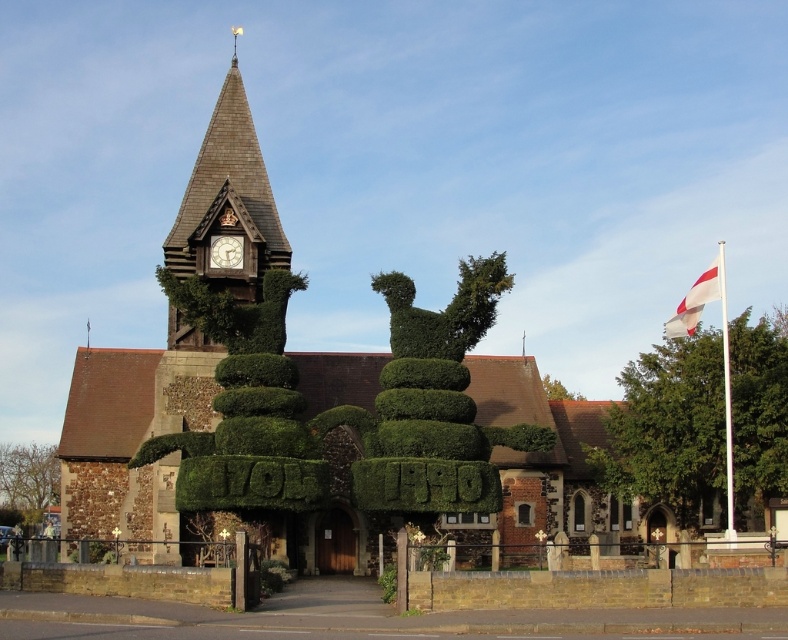
Question: Can you confirm if green leafy bush at lower left is smaller than green leafy tree at center?

Choices:
 (A) no
 (B) yes

Answer: (A)

Question: Which object is closer to the camera taking this photo?

Choices:
 (A) wooden clock at center
 (B) green leafy tree at right

Answer: (B)

Question: Which of the following is the farthest from the observer?

Choices:
 (A) (235, 262)
 (B) (9, 486)
 (C) (701, 276)

Answer: (B)

Question: Among these objects, which one is nearest to the camera?

Choices:
 (A) white fabric flag at right
 (B) wooden shingles clock tower at upper center
 (C) green leafy bush at lower left
 (D) wooden clock at center

Answer: (A)

Question: Is green leafy bush at lower left above white fabric flag at right?

Choices:
 (A) no
 (B) yes

Answer: (A)

Question: Is green leafy tree at right positioned in front of green leafy tree at center?

Choices:
 (A) yes
 (B) no

Answer: (A)